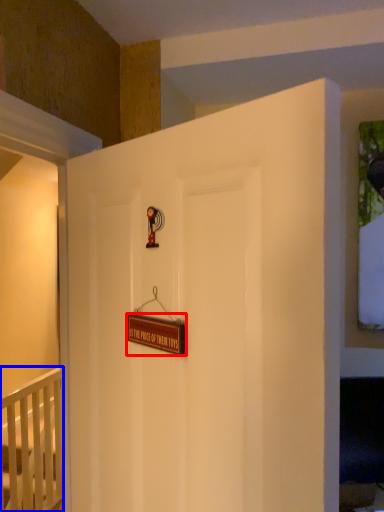
Question: Which point is further to the camera, plaque (highlighted by a red box) or infant bed (highlighted by a blue box)?

Choices:
 (A) plaque
 (B) infant bed

Answer: (B)